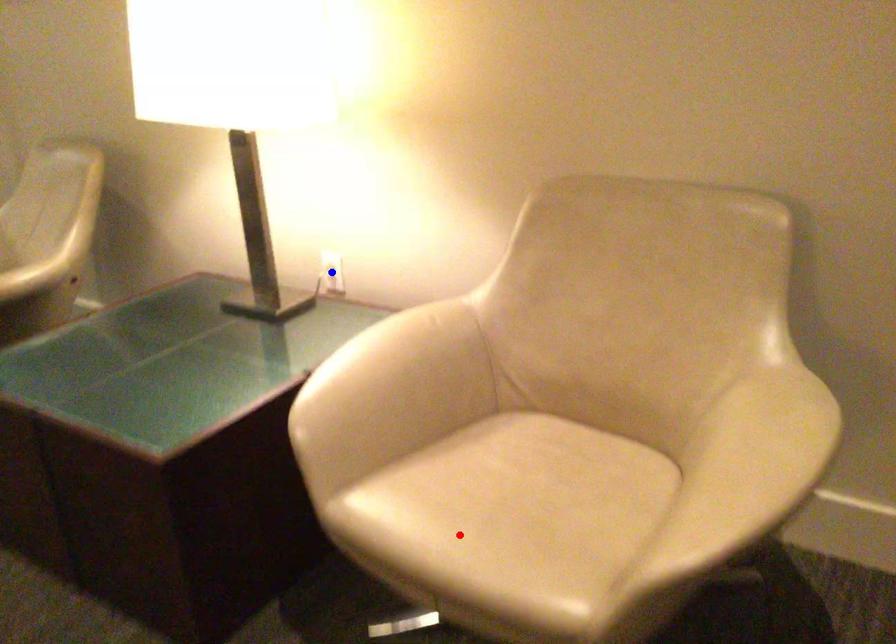
Question: In the image, two points are highlighted. Which point is nearer to the camera? Reply with the corresponding letter.

Choices:
 (A) blue point
 (B) red point

Answer: (B)